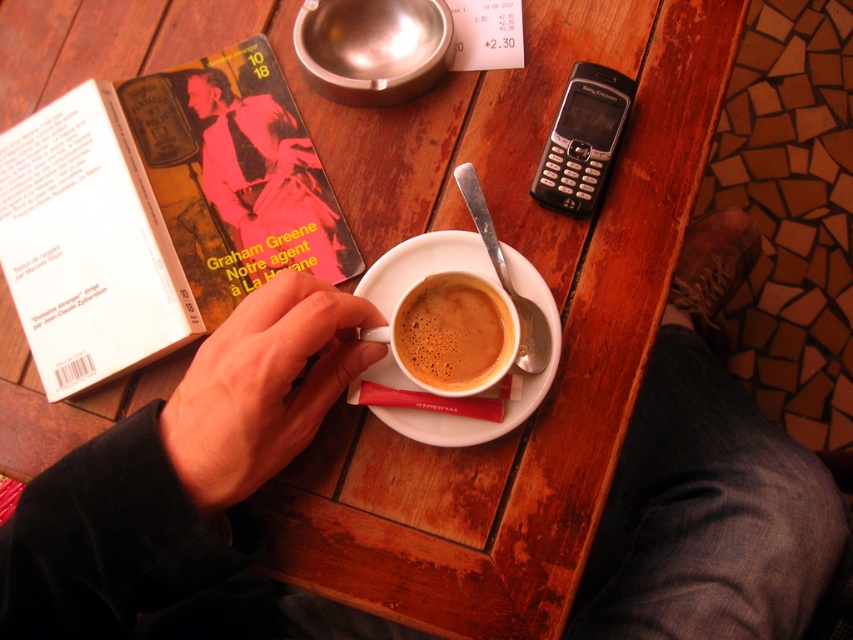
You are a librarian who needs to place both the hardcover book at upper left and the pink paper book at upper left on a shelf that is 10 centimeters wide. Can both books fit side by side on the shelf?

The hardcover book at upper left is 5.33 centimeters away from the pink paper book at upper left, so the total space needed would be 5.33 cm plus the width of both books. However, since we don not have the individual widths of each book, it is impossible to determine if they will fit on the 10 cm shelf.

You are a barista trying to clean the table. You need to reach the matte ceramic cup at center to wash it. However, the white ceramic saucer at center is blocking your access. Can you lift the saucer to get to the cup?

The matte ceramic cup at center is behind the white ceramic saucer at center, so you can lift the white ceramic saucer at center to access the cup.